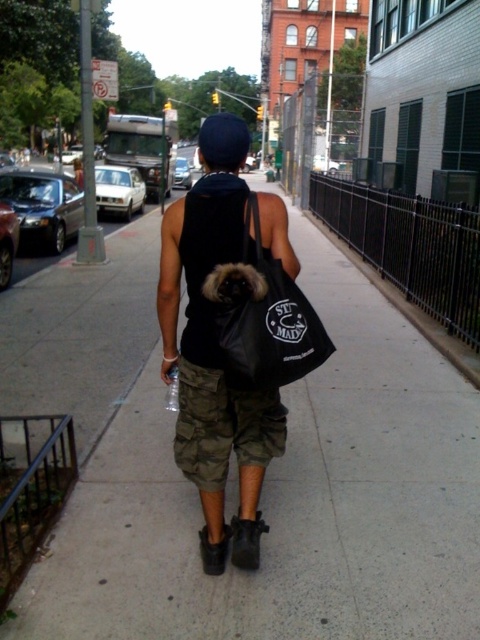
You are a delivery person who needs to choose between the black matte bag at center and the black canvas tote at center to carry a package that requires a larger capacity. Which bag should you choose?

The black matte bag at center is larger in size than the black canvas tote at center, so you should choose the black matte bag at center for the package that requires a larger capacity.

You are a delivery drone trying to land on the matte concrete sidewalk at center. However, there is a black canvas tote at center in the way. Can you safely land on the sidewalk without hitting the tote?

The matte concrete sidewalk at center is located below the black canvas tote at center, so the drone can safely land on the sidewalk as long as it approaches from below the tote.